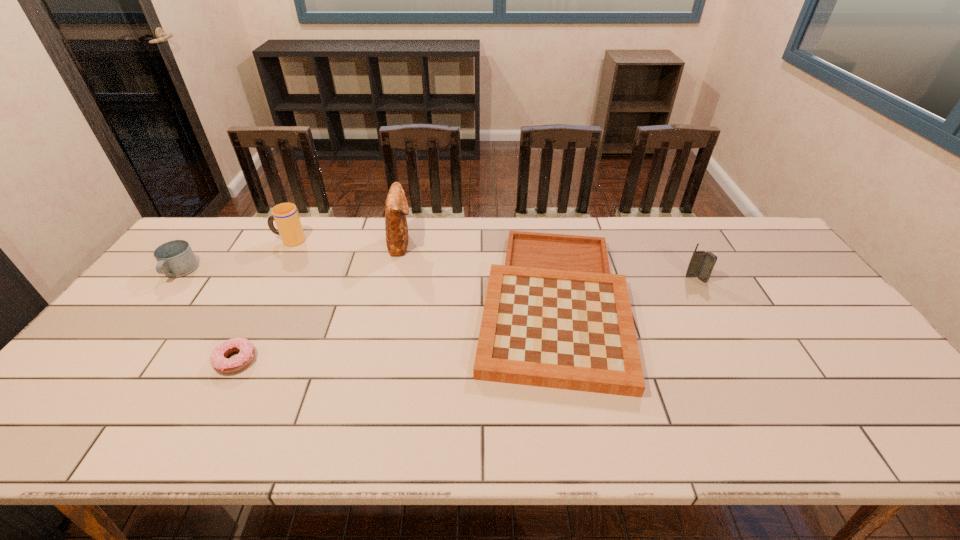
Where is `object that is at the left edge`? Image resolution: width=960 pixels, height=540 pixels. object that is at the left edge is located at coordinates (176, 258).

Image resolution: width=960 pixels, height=540 pixels. I want to click on object situated at the far left corner, so click(x=176, y=258).

The image size is (960, 540). I want to click on vacant space at the far edge, so click(x=383, y=250).

This screenshot has height=540, width=960. Find the location of `free spot at the near edge of the desktop`. free spot at the near edge of the desktop is located at coordinates (715, 443).

In the image, there is a desktop. Where is `vacant space at the left edge`? vacant space at the left edge is located at coordinates (129, 360).

I want to click on free region at the right edge of the desktop, so click(845, 338).

Locate an element on the screen. The height and width of the screenshot is (540, 960). vacant space at the far left corner of the desktop is located at coordinates (227, 233).

The height and width of the screenshot is (540, 960). In the image, there is a desktop. What are the coordinates of `free space at the near left corner` in the screenshot? It's located at (97, 422).

This screenshot has width=960, height=540. What are the coordinates of `vacant space at the far right corner of the desktop` in the screenshot? It's located at (760, 248).

The width and height of the screenshot is (960, 540). What are the coordinates of `free space that is in between the fourth tallest object and the doughnut` in the screenshot? It's located at (207, 316).